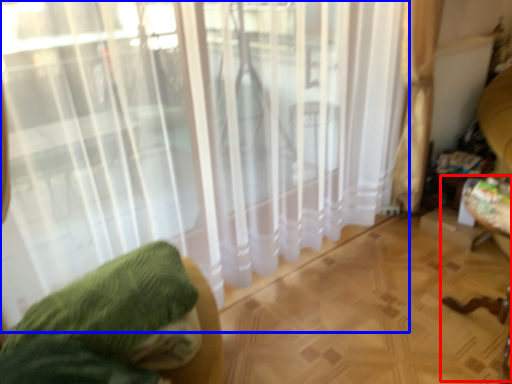
Question: Which object appears closest to the camera in this image, swivel chair (highlighted by a red box) or curtain (highlighted by a blue box)?

Choices:
 (A) swivel chair
 (B) curtain

Answer: (B)